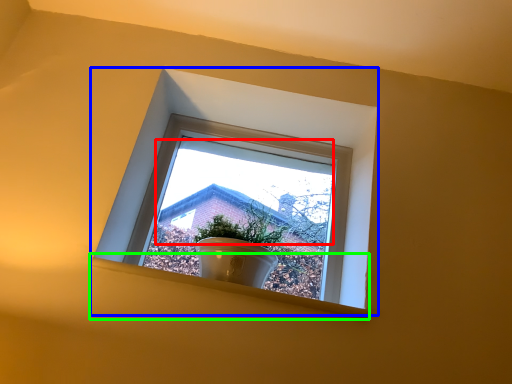
Question: Which object is positioned closest to morning light (highlighted by a red box)? Select from window (highlighted by a blue box) and window sill (highlighted by a green box).

Choices:
 (A) window
 (B) window sill

Answer: (A)